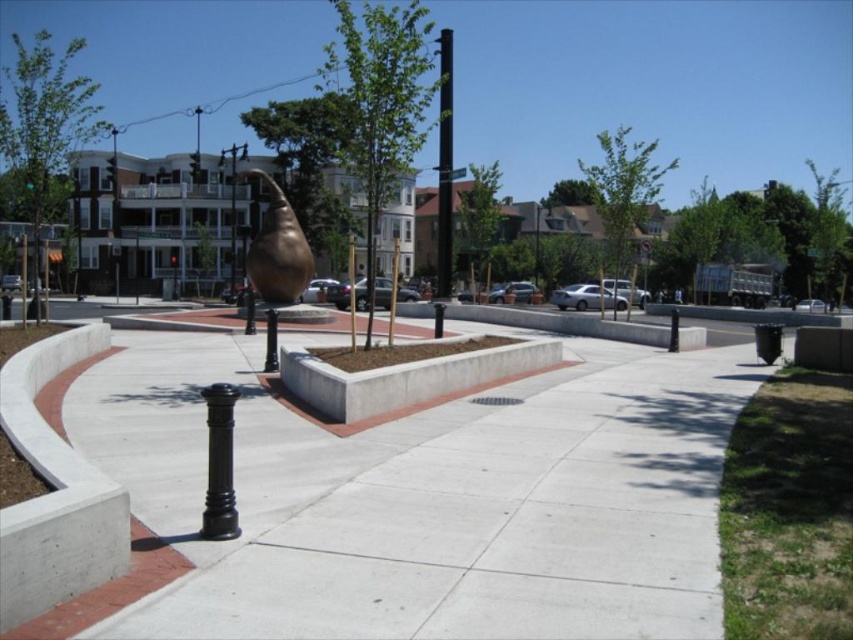
You are standing at the entrance of the plaza and want to reach a point that is behind both point (115, 164) and point (229, 275). Which point should you pass first?

You should pass point (115, 164) first because it is in front of point (229, 275), so to reach a point behind both, you must go past point (115, 164) first.

You are a city planner reviewing the plaza layout. You need to determine if the concrete at center will block the view of the bronze metallic lamp post at upper left from a pedestrian standing at the walkway edge. Can you confirm this?

The concrete at center has a lesser height compared to bronze metallic lamp post at upper left, so the bronze metallic lamp post at upper left will be visible above the concrete at center from the walkway edge.

You are an architect designing a new lighting system for the plaza. You need to ensure that the bronze metallic lamp post at upper left and the metallic pole at upper center do not cast overlapping shadows during midday. Given their positions, which object should be adjusted to avoid shadow overlap?

The bronze metallic lamp post at upper left is above the metallic pole at upper center. To prevent overlapping shadows, the bronze metallic lamp post at upper left should be adjusted since it is positioned higher and would cast a larger shadow over the lower metallic pole at upper center.